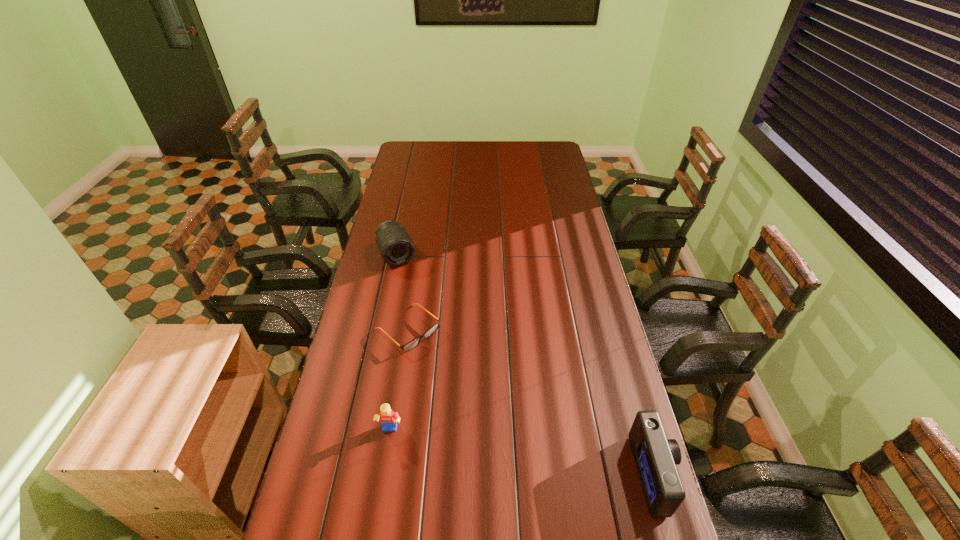
Identify the location of empty space that is in between the rightmost object and the farthest object. (525, 365).

Find the location of `free spot between the shortest object and the Lego`. free spot between the shortest object and the Lego is located at coordinates (399, 380).

Locate an element on the screen. This screenshot has height=540, width=960. free space between the third nearest object and the Lego is located at coordinates (399, 380).

This screenshot has width=960, height=540. What are the coordinates of `unoccupied position between the Lego and the third nearest object` in the screenshot? It's located at (399, 380).

Where is `free space between the rightmost object and the spectacles`? free space between the rightmost object and the spectacles is located at coordinates (531, 402).

Where is `vacant area that lies between the farthest object and the spectacles`? The height and width of the screenshot is (540, 960). vacant area that lies between the farthest object and the spectacles is located at coordinates (402, 292).

What are the coordinates of `free area in between the Lego and the farthest object` in the screenshot? It's located at (394, 343).

Find the location of `blank region between the spectacles and the telephoto lens`. blank region between the spectacles and the telephoto lens is located at coordinates (402, 292).

Locate an element on the screen. The image size is (960, 540). empty space between the second shortest object and the third nearest object is located at coordinates (399, 380).

Locate an element on the screen. Image resolution: width=960 pixels, height=540 pixels. vacant point located between the farthest object and the Lego is located at coordinates (394, 343).